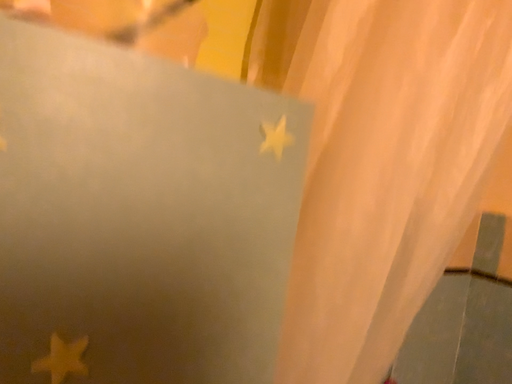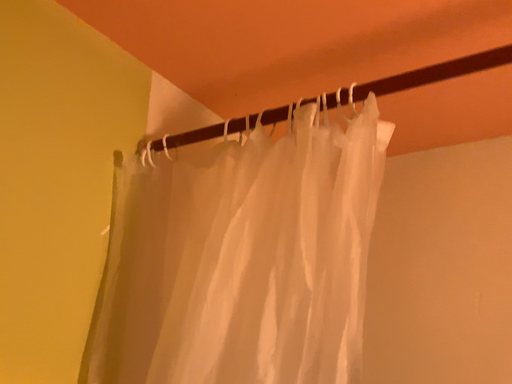
Question: How did the camera likely rotate when shooting the video?

Choices:
 (A) rotated left
 (B) rotated right

Answer: (B)